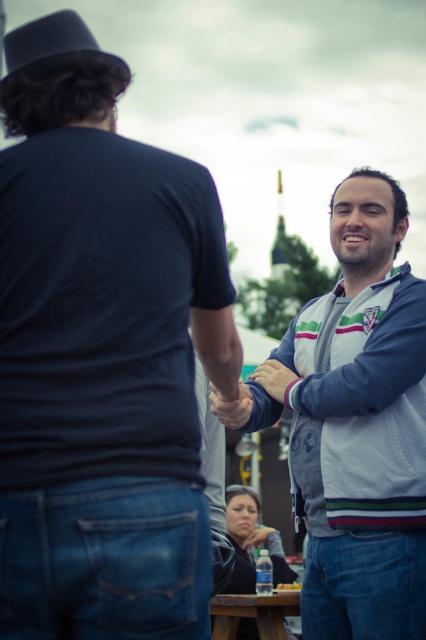
In the scene shown: You are planning to place a small potted plant between the white striped jacket at center and the brown wooden picnic table at lower center. Based on their positions, where should you position the plant to ensure it is between both objects?

The white striped jacket at center is located above the brown wooden picnic table at lower center, so placing the plant between them would require positioning it below the jacket and above the picnic table to be in between both objects.

You are planning to place a decorative hat on the brown wooden picnic table at lower center. However, there is already a black felt fedora at upper left. Based on their positions, can the hat be placed on the table without moving the existing fedora?

The black felt fedora at upper left is positioned over the brown wooden picnic table at lower center, so placing another hat on the table would require moving the existing fedora first.